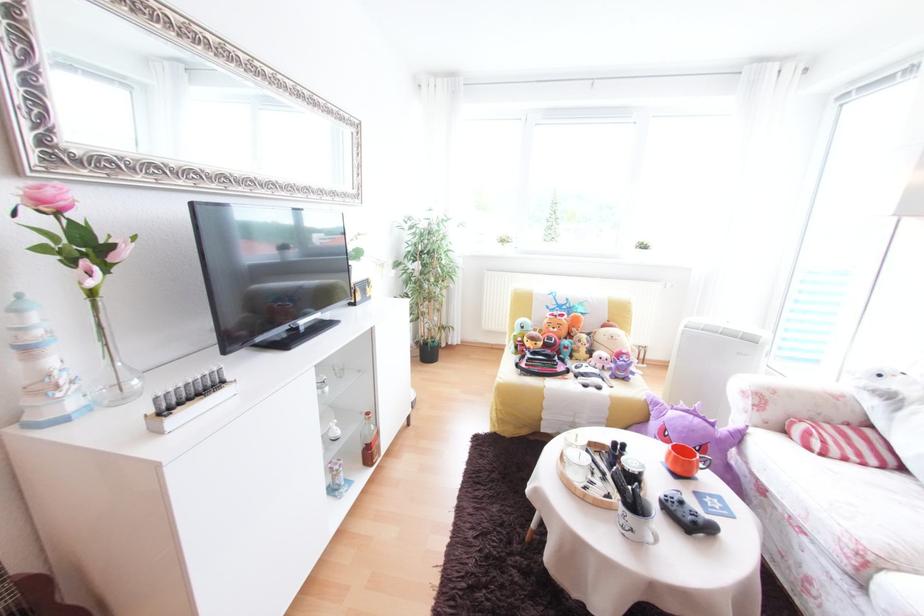
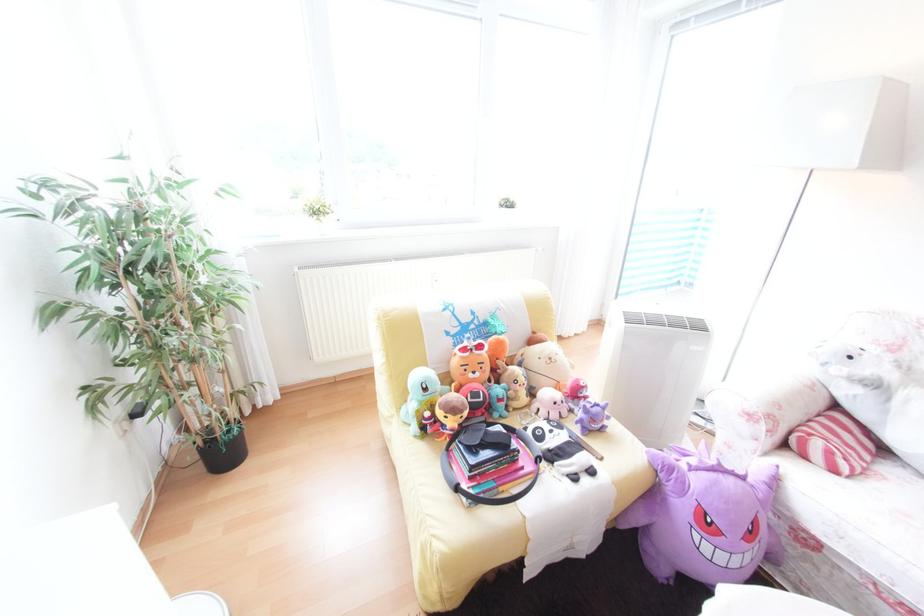
In the second image, find the point that corresponds to [442,342] in the first image.

(237, 432)